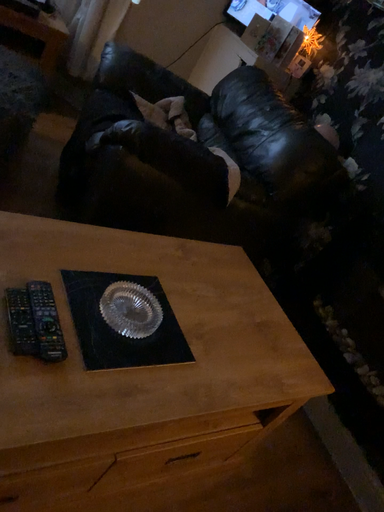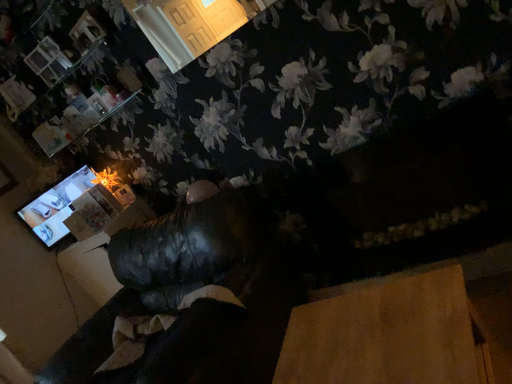
Question: Which way did the camera rotate in the video?

Choices:
 (A) rotated downward
 (B) rotated upward

Answer: (B)